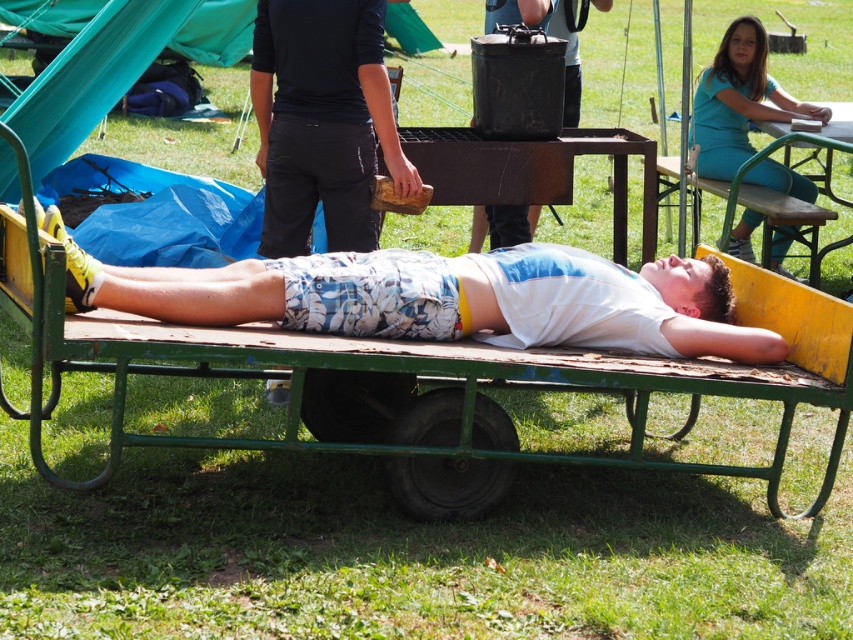
Question: Is white matte shirt at center closer to camera compared to black matte pot at upper center?

Choices:
 (A) no
 (B) yes

Answer: (B)

Question: Which of the following is the farthest from the observer?

Choices:
 (A) (569, 77)
 (B) (785, 342)
 (C) (810, 276)
 (D) (326, 54)

Answer: (C)

Question: Is black matte pants at center above green wood park bench at upper right?

Choices:
 (A) yes
 (B) no

Answer: (A)

Question: Observing the image, what is the correct spatial positioning of black matte pants at center in reference to green wood park bench at upper right?

Choices:
 (A) above
 (B) below

Answer: (A)

Question: Which point is closer to the camera taking this photo?

Choices:
 (A) (454, 460)
 (B) (490, 212)
 (C) (741, 54)
 (D) (817, 268)

Answer: (A)

Question: Which of the following is the farthest from the observer?

Choices:
 (A) black matte pants at center
 (B) white matte shirt at center

Answer: (A)